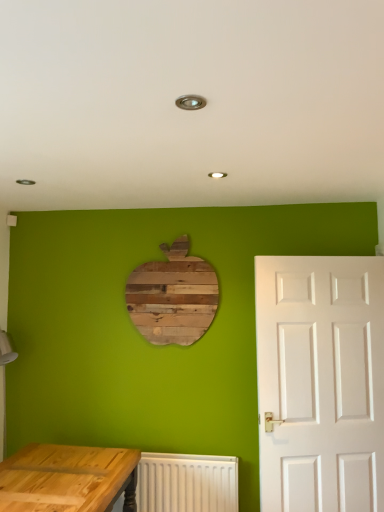
This screenshot has width=384, height=512. I want to click on white matte radiator at lower center, so click(x=186, y=483).

Describe the element at coordinates (186, 483) in the screenshot. I see `white matte radiator at lower center` at that location.

Locate an element on the screen. white matte radiator at lower center is located at coordinates (186, 483).